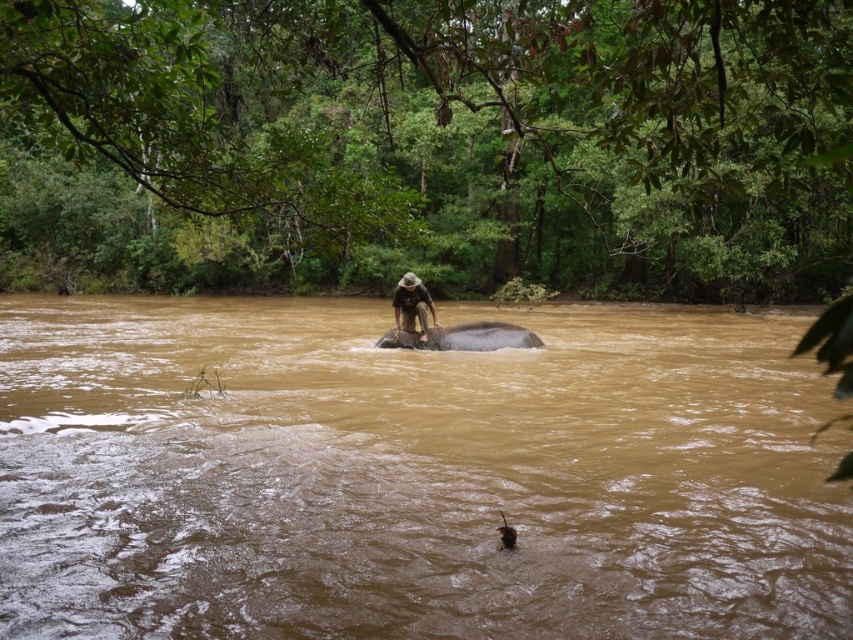
Can you confirm if brown muddy water at center is thinner than gray matte elephant at center?

No.

Can you confirm if brown muddy water at center is taller than gray matte elephant at center?

Correct, brown muddy water at center is much taller as gray matte elephant at center.

I want to click on brown muddy water at center, so click(412, 476).

Does brown muddy water at center have a lesser height compared to brown textured baby elephant at lower center?

Incorrect, brown muddy water at center's height does not fall short of brown textured baby elephant at lower center's.

Can you confirm if brown muddy water at center is thinner than brown textured baby elephant at lower center?

In fact, brown muddy water at center might be wider than brown textured baby elephant at lower center.

The height and width of the screenshot is (640, 853). I want to click on brown muddy water at center, so click(412, 476).

At what (x,y) coordinates should I click in order to perform the action: click on brown muddy water at center. Please return your answer as a coordinate pair (x, y). The image size is (853, 640). Looking at the image, I should click on (412, 476).

Describe the element at coordinates (463, 337) in the screenshot. This screenshot has width=853, height=640. I see `gray matte elephant at center` at that location.

Is gray matte elephant at center below brown textured baby elephant at lower center?

Incorrect, gray matte elephant at center is not positioned below brown textured baby elephant at lower center.

The width and height of the screenshot is (853, 640). What do you see at coordinates (463, 337) in the screenshot?
I see `gray matte elephant at center` at bounding box center [463, 337].

At what (x,y) coordinates should I click in order to perform the action: click on gray matte elephant at center. Please return your answer as a coordinate pair (x, y). Looking at the image, I should click on (463, 337).